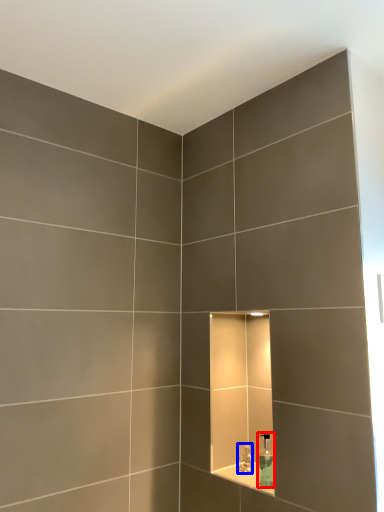
Question: Which of the following is the farthest to the observer, soap dispenser (highlighted by a red box) or faucet (highlighted by a blue box)?

Choices:
 (A) soap dispenser
 (B) faucet

Answer: (B)